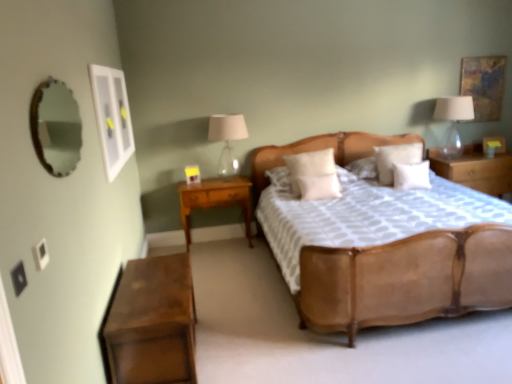
The image size is (512, 384). Identify the location of free space that is in between leather bed at center and light wood/wooden nightstand at lower left, the 2th nightstand viewed from the front. (245, 283).